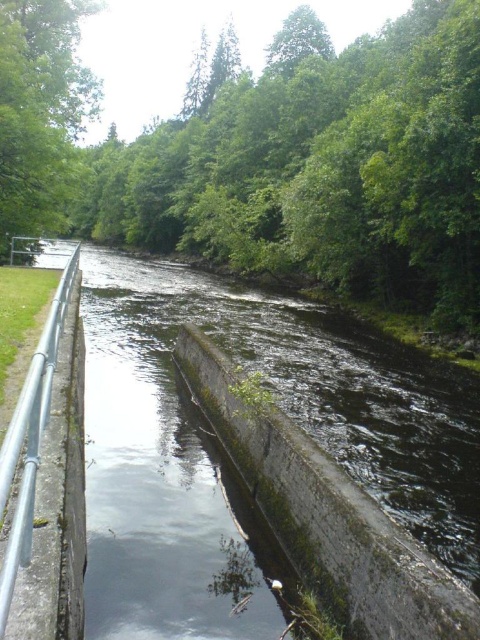
Looking at this image, how distant is green leafy tree at upper center from green leafy tree at upper left?

They are 120.75 feet apart.

Is point (147, 248) farther from viewer compared to point (46, 108)?

Yes, it is behind point (46, 108).

Identify the location of green leafy tree at upper center. The height and width of the screenshot is (640, 480). (322, 164).

This screenshot has height=640, width=480. What are the coordinates of `green leafy tree at upper center` in the screenshot? It's located at (322, 164).

Is green leafy tree at upper center closer to the viewer compared to silver metallic rail at left?

No, it is behind silver metallic rail at left.

Between point (328, 122) and point (26, 560), which one is positioned in front?

Positioned in front is point (26, 560).

At what (x,y) coordinates should I click in order to perform the action: click on green leafy tree at upper center. Please return your answer as a coordinate pair (x, y). Looking at the image, I should click on (322, 164).

Is dark green concrete at center to the left of silver metallic rail at left from the viewer's perspective?

In fact, dark green concrete at center is to the right of silver metallic rail at left.

Can you confirm if dark green concrete at center is smaller than silver metallic rail at left?

Actually, dark green concrete at center might be larger than silver metallic rail at left.

Image resolution: width=480 pixels, height=640 pixels. In order to click on dark green concrete at center in this screenshot , I will do `click(223, 460)`.

You are a GUI agent. You are given a task and a screenshot of the screen. Output one action in this format:
    pyautogui.click(x=<x>, y=<y>)
    Task: Click on the dark green concrete at center
    This screenshot has height=640, width=480.
    Given the screenshot: What is the action you would take?
    pyautogui.click(x=223, y=460)